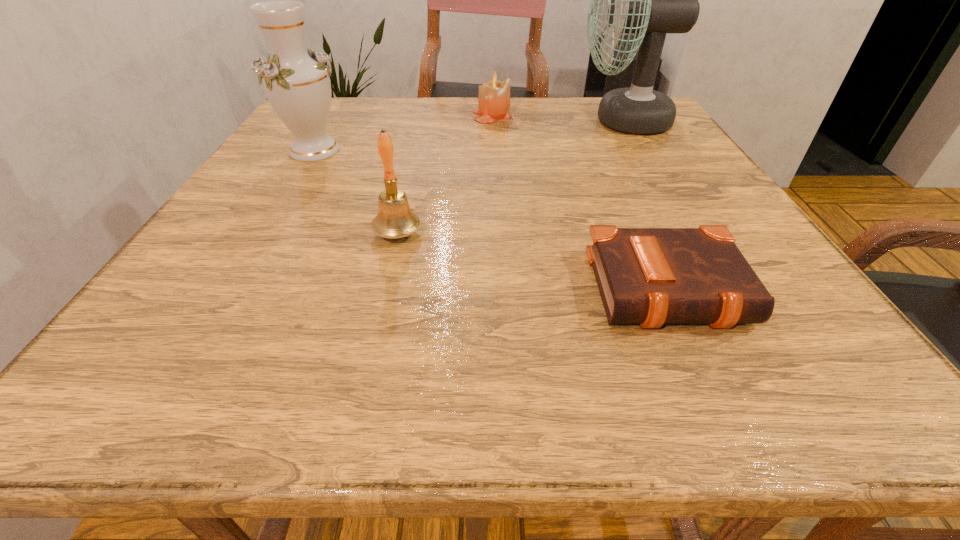
This screenshot has width=960, height=540. Find the location of `free spot between the fan and the Bible`. free spot between the fan and the Bible is located at coordinates (648, 206).

In order to click on free space between the second tallest object and the second object from left to right in this screenshot , I will do `click(356, 192)`.

Where is `free space between the second object from left to right and the third object from left to right`? The width and height of the screenshot is (960, 540). free space between the second object from left to right and the third object from left to right is located at coordinates (444, 174).

At what (x,y) coordinates should I click in order to perform the action: click on unoccupied area between the candle and the second tallest object. Please return your answer as a coordinate pair (x, y). The height and width of the screenshot is (540, 960). Looking at the image, I should click on (403, 133).

Where is `free space between the third object from left to right and the nearest object`? This screenshot has height=540, width=960. free space between the third object from left to right and the nearest object is located at coordinates (583, 202).

Locate an element on the screen. This screenshot has height=540, width=960. free spot between the third shortest object and the Bible is located at coordinates (536, 262).

The image size is (960, 540). What are the coordinates of `empty space between the fan and the Bible` in the screenshot? It's located at (648, 206).

Identify which object is the fourth nearest to the second tallest object. Please provide its 2D coordinates. Your answer should be formatted as a tuple, i.e. [(x, y)], where the tuple contains the x and y coordinates of a point satisfying the conditions above.

[(648, 276)]

I want to click on the third closest object relative to the nearest object, so 494,96.

This screenshot has width=960, height=540. I want to click on vacant space that satisfies the following two spatial constraints: 1. on the back side of the bell; 2. on the left side of the candle, so click(425, 115).